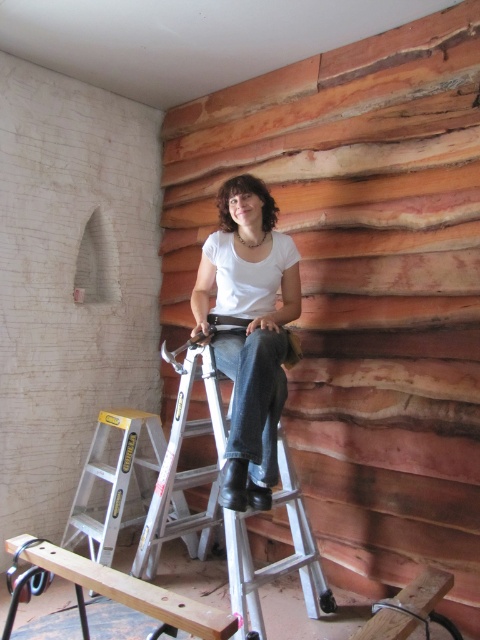
Question: Which of these objects is positioned closest to the wooden plank at lower center?

Choices:
 (A) silver metallic ladder at center
 (B) matte white shirt at center
 (C) silver metallic ladder at lower left

Answer: (A)

Question: Estimate the real-world distances between objects in this image. Which object is farther from the matte white shirt at center?

Choices:
 (A) silver metallic ladder at center
 (B) silver metallic ladder at lower left

Answer: (B)

Question: In this image, where is matte white shirt at center located relative to silver metallic ladder at center?

Choices:
 (A) above
 (B) below

Answer: (A)

Question: Can you confirm if silver metallic ladder at center is positioned to the right of silver metallic ladder at lower left?

Choices:
 (A) no
 (B) yes

Answer: (B)

Question: Considering the relative positions of matte white shirt at center and silver metallic ladder at lower left in the image provided, where is matte white shirt at center located with respect to silver metallic ladder at lower left?

Choices:
 (A) left
 (B) right

Answer: (B)

Question: Among these points, which one is nearest to the camera?

Choices:
 (A) (155, 600)
 (B) (154, 420)
 (C) (235, 614)
 (D) (242, 451)

Answer: (A)